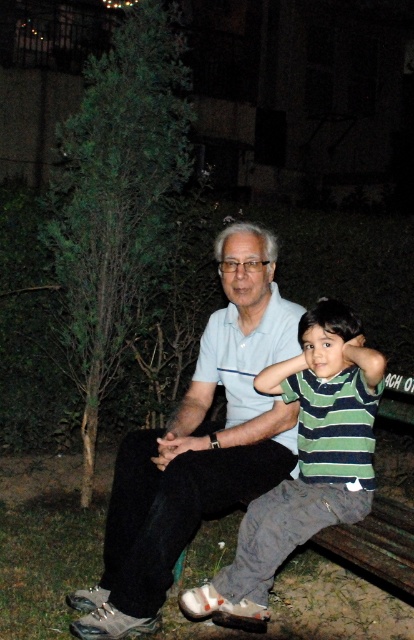
Question: Does light blue cotton shirt at center appear over striped cotton shirt at center?

Choices:
 (A) no
 (B) yes

Answer: (B)

Question: Which point is closer to the camera taking this photo?

Choices:
 (A) (255, 529)
 (B) (170, 476)

Answer: (A)

Question: Which point appears farthest from the camera in this image?

Choices:
 (A) (276, 381)
 (B) (192, 394)

Answer: (B)

Question: Which object is farther from the camera taking this photo?

Choices:
 (A) light blue cotton shirt at center
 (B) striped cotton shirt at center

Answer: (A)

Question: Does light blue cotton shirt at center appear on the right side of striped cotton shirt at center?

Choices:
 (A) yes
 (B) no

Answer: (B)

Question: Does light blue cotton shirt at center have a smaller size compared to striped cotton shirt at center?

Choices:
 (A) no
 (B) yes

Answer: (A)